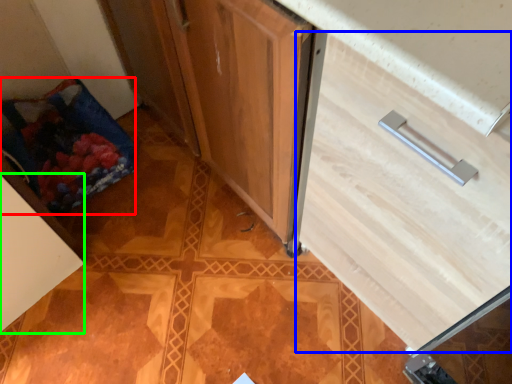
Question: Considering the real-world distances, which object is closest to material (highlighted by a red box)? drawer (highlighted by a blue box) or cabinetry (highlighted by a green box).

Choices:
 (A) drawer
 (B) cabinetry

Answer: (B)